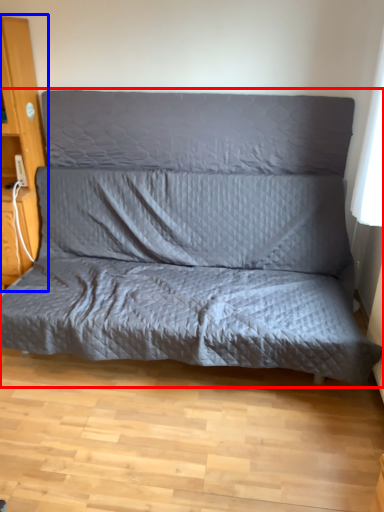
Question: Among these objects, which one is nearest to the camera, studio couch (highlighted by a red box) or dresser (highlighted by a blue box)?

Choices:
 (A) studio couch
 (B) dresser

Answer: (A)